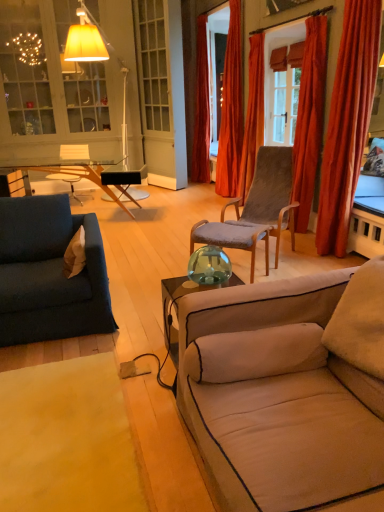
Question: From a real-world perspective, is matte glass cabinet at upper left positioned above or below beige fabric couch at lower right, placed as the 2th studio couch when sorted from back to front?

Choices:
 (A) above
 (B) below

Answer: (A)

Question: Would you say matte glass cabinet at upper left is inside or outside beige fabric couch at lower right, placed as the 2th studio couch when sorted from back to front?

Choices:
 (A) inside
 (B) outside

Answer: (B)

Question: Based on their relative distances, which object is farther from the velvet orange curtain at upper right, which is the fourth curtain from back to front?

Choices:
 (A) velvet orange curtain at upper right, which ranks as the fourth curtain in front-to-back order
 (B) velvet orange curtain at right, marked as the fifth curtain in a back-to-front arrangement
 (C) beige fabric couch at lower right, which is counted as the first studio couch, starting from the front
 (D) transparent glass vase at center
 (E) velvet blue couch at left, which appears as the 2th studio couch when viewed from the front

Answer: (C)

Question: Which of these objects is positioned farthest from the beige fabric pillow at left?

Choices:
 (A) clear glass window at center
 (B) velvet orange curtain at center, which is the 5th curtain from front to back
 (C) velvet orange curtain at upper right, the 2th curtain positioned from the front
 (D) beige fabric couch at lower right, which is the 1th studio couch from right to left
 (E) velvet orange curtain at upper right, arranged as the second curtain when viewed from the back

Answer: (B)